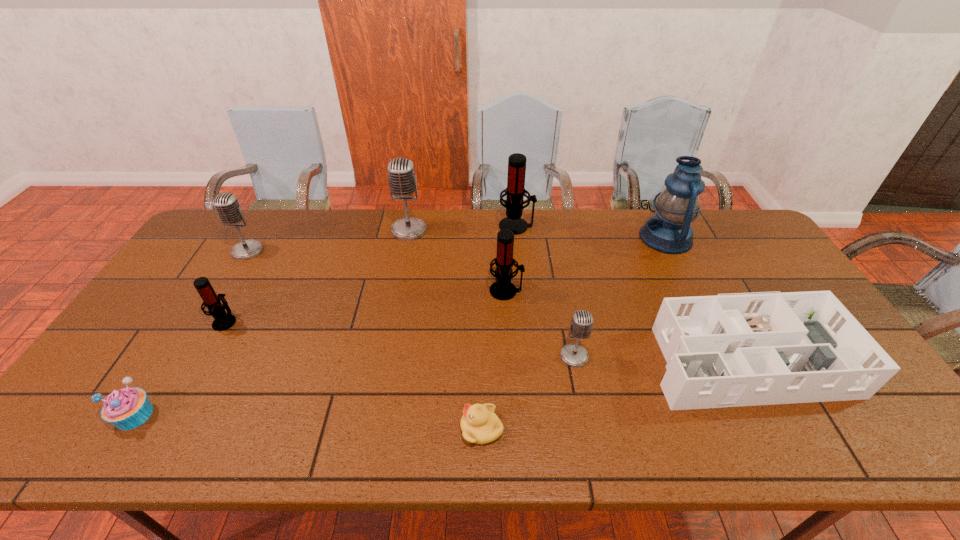
Identify the location of blank area located on the left of the farthest red microphone. Image resolution: width=960 pixels, height=540 pixels. [x=428, y=226].

Locate an element on the screen. This screenshot has height=540, width=960. vacant space located 0.050m on the right of the farthest gray microphone is located at coordinates (441, 230).

Where is `free space located on the front of the third farthest microphone`? free space located on the front of the third farthest microphone is located at coordinates (219, 298).

I want to click on free space located 0.120m on the right of the third nearest microphone, so click(x=563, y=291).

The image size is (960, 540). I want to click on vacant position located 0.100m on the front of the smallest red microphone, so click(203, 361).

Find the location of a particular element. This screenshot has height=540, width=960. free space located 0.200m on the back of the smallest gray microphone is located at coordinates (562, 292).

Where is `free space located on the left of the third shortest object`? free space located on the left of the third shortest object is located at coordinates pos(618,352).

At what (x,y) coordinates should I click in order to perform the action: click on vacant point located 0.270m on the right of the blue muffin. Please return your answer as a coordinate pair (x, y). Looking at the image, I should click on (270, 415).

Where is `vacant position located 0.090m on the front-facing side of the yellow duckling`? The image size is (960, 540). vacant position located 0.090m on the front-facing side of the yellow duckling is located at coordinates (420, 428).

Identify the location of vacant space located on the front-facing side of the yellow duckling. (346, 428).